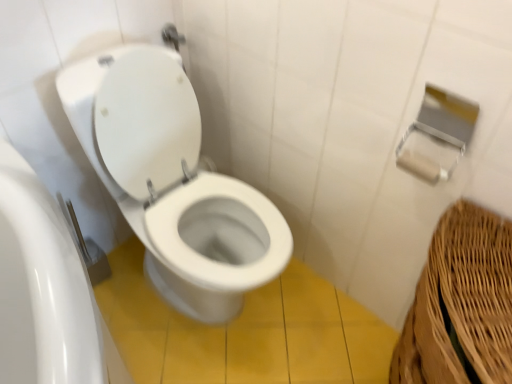
What is the approximate height of white matte toilet paper at upper right?

The height of white matte toilet paper at upper right is 2.07 inches.

Describe the element at coordinates (420, 166) in the screenshot. Image resolution: width=512 pixels, height=384 pixels. I see `white matte toilet paper at upper right` at that location.

Measure the distance between point (407, 163) and camera.

They are 3.33 feet apart.

The width and height of the screenshot is (512, 384). In order to click on white matte toilet paper at upper right in this screenshot , I will do `click(420, 166)`.

The image size is (512, 384). I want to click on white glossy toilet at center, so click(172, 181).

Describe the element at coordinates (172, 181) in the screenshot. I see `white glossy toilet at center` at that location.

Find the location of a particular element. The width and height of the screenshot is (512, 384). white matte toilet paper at upper right is located at coordinates (420, 166).

Which is more to the right, white glossy toilet at center or white matte toilet paper at upper right?

A: From the viewer's perspective, white matte toilet paper at upper right appears more on the right side.

Is white glossy toilet at center closer to camera compared to white matte toilet paper at upper right?

Yes, white glossy toilet at center is in front of white matte toilet paper at upper right.

Is point (137, 194) closer or farther from the camera than point (409, 164)?

Point (137, 194).

From the image's perspective, which is below, white glossy toilet at center or white matte toilet paper at upper right?

white glossy toilet at center, from the image's perspective.

From a real-world perspective, who is located higher, white glossy toilet at center or white matte toilet paper at upper right?

white matte toilet paper at upper right is physically above.

Which of these two, white glossy toilet at center or white matte toilet paper at upper right, is thinner?

Thinner between the two is white matte toilet paper at upper right.

From their relative heights in the image, would you say white glossy toilet at center is taller or shorter than white matte toilet paper at upper right?

In the image, white glossy toilet at center appears to be taller than white matte toilet paper at upper right.

Is white glossy toilet at center bigger than white matte toilet paper at upper right?

Yes.

Is white matte toilet paper at upper right located within white glossy toilet at center?

No.

Is white glossy toilet at center with white matte toilet paper at upper right?

No.

Could you tell me if white glossy toilet at center is turned towards white matte toilet paper at upper right?

No, white glossy toilet at center is not oriented towards white matte toilet paper at upper right.

How many degrees apart are the facing directions of white glossy toilet at center and white matte toilet paper at upper right?

89.6 degrees separate the facing orientations of white glossy toilet at center and white matte toilet paper at upper right.

Find the location of a particular element. The image size is (512, 384). toilet in front of the white matte toilet paper at upper right is located at coordinates (172, 181).

Considering the relative positions of white matte toilet paper at upper right and white glossy toilet at center in the image provided, is white matte toilet paper at upper right to the left of white glossy toilet at center from the viewer's perspective?

Incorrect, white matte toilet paper at upper right is not on the left side of white glossy toilet at center.

Which is behind, white matte toilet paper at upper right or white glossy toilet at center?

white matte toilet paper at upper right is more distant.

Which point is more distant from viewer, (432, 168) or (261, 222)?

The point (261, 222) is farther from the camera.

From the image's perspective, is white matte toilet paper at upper right located beneath white glossy toilet at center?

Actually, white matte toilet paper at upper right appears above white glossy toilet at center in the image.

From a real-world perspective, is white matte toilet paper at upper right located beneath white glossy toilet at center?

No, from a real-world perspective, white matte toilet paper at upper right is not beneath white glossy toilet at center.

Which of these two, white matte toilet paper at upper right or white glossy toilet at center, is thinner?

white matte toilet paper at upper right.

Can you confirm if white matte toilet paper at upper right is shorter than white glossy toilet at center?

Yes, white matte toilet paper at upper right is shorter than white glossy toilet at center.

In terms of size, does white matte toilet paper at upper right appear bigger or smaller than white glossy toilet at center?

Clearly, white matte toilet paper at upper right is smaller in size than white glossy toilet at center.

Does white matte toilet paper at upper right contain white glossy toilet at center?

No, white glossy toilet at center is not surrounded by white matte toilet paper at upper right.

Is white matte toilet paper at upper right beside white glossy toilet at center?

There is a gap between white matte toilet paper at upper right and white glossy toilet at center.

Is white matte toilet paper at upper right positioned with its back to white glossy toilet at center?

No, white matte toilet paper at upper right is not facing the opposite direction of white glossy toilet at center.

What's the angular difference between white matte toilet paper at upper right and white glossy toilet at center's facing directions?

There is a 89.6-degree angle between the facing directions of white matte toilet paper at upper right and white glossy toilet at center.

Measure the distance from white matte toilet paper at upper right to white glossy toilet at center.

The distance of white matte toilet paper at upper right from white glossy toilet at center is 26.18 inches.

In order to click on toilet paper above the white glossy toilet at center (from the image's perspective) in this screenshot , I will do `click(420, 166)`.

Locate an element on the screen. toilet lying on the left of white matte toilet paper at upper right is located at coordinates (172, 181).

Find the location of `toilet paper on the right of white glossy toilet at center`. toilet paper on the right of white glossy toilet at center is located at coordinates (420, 166).